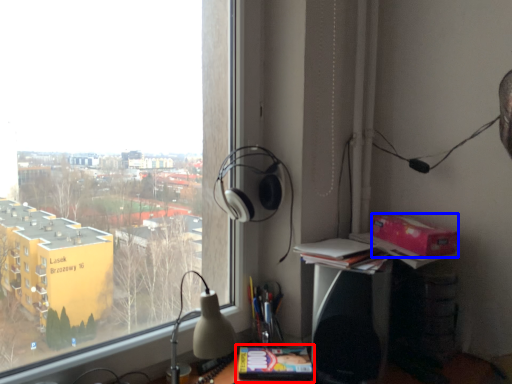
Question: Among these objects, which one is farthest to the camera, paperback book (highlighted by a red box) or cardboard box (highlighted by a blue box)?

Choices:
 (A) paperback book
 (B) cardboard box

Answer: (B)